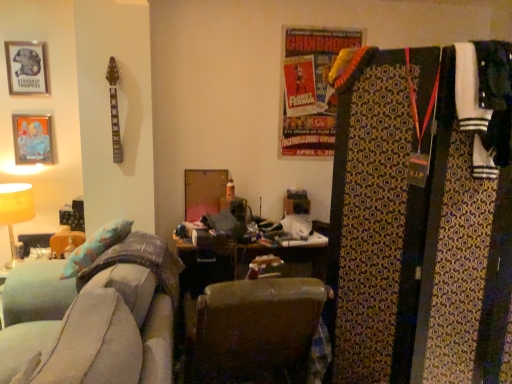
Question: Should I look upward or downward to see matte yellow table lamp at left?

Choices:
 (A) up
 (B) down

Answer: (B)

Question: Does metallic silver picture frame at upper left, which is counted as the 2th picture frame, starting from the bottom, have a smaller size compared to white jersey at right?

Choices:
 (A) yes
 (B) no

Answer: (A)

Question: Is metallic silver picture frame at upper left, placed as the 1th picture frame when sorted from top to bottom, beside white jersey at right?

Choices:
 (A) yes
 (B) no

Answer: (B)

Question: From a real-world perspective, is metallic silver picture frame at upper left, which is counted as the 2th picture frame, starting from the bottom, on top of white jersey at right?

Choices:
 (A) yes
 (B) no

Answer: (A)

Question: Is metallic silver picture frame at upper left, which is counted as the 2th picture frame, starting from the bottom, wider than white jersey at right?

Choices:
 (A) no
 (B) yes

Answer: (A)

Question: Is metallic silver picture frame at upper left, which is counted as the 2th picture frame, starting from the bottom, outside white jersey at right?

Choices:
 (A) no
 (B) yes

Answer: (B)

Question: From a real-world perspective, is metallic silver picture frame at upper left, which is counted as the 2th picture frame, starting from the bottom, physically below white jersey at right?

Choices:
 (A) yes
 (B) no

Answer: (B)

Question: Would you say patterned fabric tie at right is a long distance from matte yellow table lamp at left?

Choices:
 (A) no
 (B) yes

Answer: (B)

Question: Is patterned fabric tie at right facing towards matte yellow table lamp at left?

Choices:
 (A) no
 (B) yes

Answer: (A)

Question: Does patterned fabric tie at right have a greater height compared to matte yellow table lamp at left?

Choices:
 (A) no
 (B) yes

Answer: (B)

Question: Is patterned fabric tie at right at the left side of matte yellow table lamp at left?

Choices:
 (A) no
 (B) yes

Answer: (A)

Question: Is patterned fabric tie at right with matte yellow table lamp at left?

Choices:
 (A) yes
 (B) no

Answer: (B)

Question: Is patterned fabric tie at right thinner than matte yellow table lamp at left?

Choices:
 (A) yes
 (B) no

Answer: (A)

Question: Does leather at center have a greater height compared to soft gray fabric couch at lower left?

Choices:
 (A) yes
 (B) no

Answer: (B)